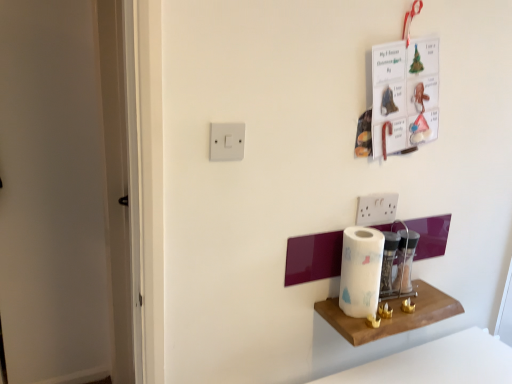
Question: Is white plastic light switch at upper center touching white paper at center?

Choices:
 (A) no
 (B) yes

Answer: (A)

Question: Is white plastic light switch at upper center positioned with its back to white paper at center?

Choices:
 (A) no
 (B) yes

Answer: (A)

Question: Is the depth of white plastic light switch at upper center less than that of white paper at center?

Choices:
 (A) no
 (B) yes

Answer: (B)

Question: Is the position of white plastic light switch at upper center more distant than that of white paper at center?

Choices:
 (A) yes
 (B) no

Answer: (B)

Question: Is white plastic light switch at upper center completely or partially outside of white paper at center?

Choices:
 (A) no
 (B) yes

Answer: (B)

Question: Is wooden shelf at lower right bigger or smaller than white plastic light switch at upper center?

Choices:
 (A) small
 (B) big

Answer: (B)

Question: Would you say wooden shelf at lower right is inside or outside white plastic light switch at upper center?

Choices:
 (A) outside
 (B) inside

Answer: (A)

Question: In terms of height, does wooden shelf at lower right look taller or shorter compared to white plastic light switch at upper center?

Choices:
 (A) tall
 (B) short

Answer: (B)

Question: From the image's perspective, is wooden shelf at lower right above or below white plastic light switch at upper center?

Choices:
 (A) above
 (B) below

Answer: (B)

Question: From the image's perspective, is white paper at center positioned above or below wooden shelf at lower right?

Choices:
 (A) below
 (B) above

Answer: (B)

Question: Is point (361, 286) closer or farther from the camera than point (331, 326)?

Choices:
 (A) closer
 (B) farther

Answer: (A)

Question: Is white paper at center bigger or smaller than wooden shelf at lower right?

Choices:
 (A) big
 (B) small

Answer: (A)

Question: In terms of height, does white paper at center look taller or shorter compared to wooden shelf at lower right?

Choices:
 (A) short
 (B) tall

Answer: (B)

Question: Based on their sizes in the image, would you say white plastic light switch at upper center is bigger or smaller than wooden shelf at lower right?

Choices:
 (A) big
 (B) small

Answer: (B)

Question: From the image's perspective, is white plastic light switch at upper center above or below wooden shelf at lower right?

Choices:
 (A) above
 (B) below

Answer: (A)